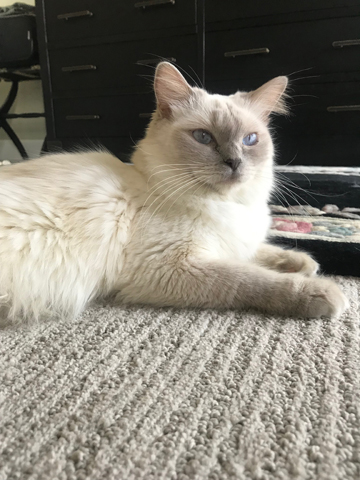
Where is `dresser`? dresser is located at coordinates (203, 40).